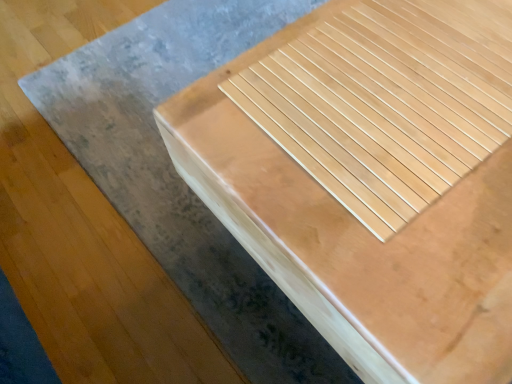
Describe the element at coordinates (371, 178) in the screenshot. The width and height of the screenshot is (512, 384). I see `natural wood table at center` at that location.

Locate an element on the screen. The width and height of the screenshot is (512, 384). natural wood table at center is located at coordinates click(371, 178).

In order to face natural wood table at center, should I rotate leftwards or rightwards?

Turn right approximately 27.995 degrees to face it.

In order to click on natural wood table at center in this screenshot , I will do `click(371, 178)`.